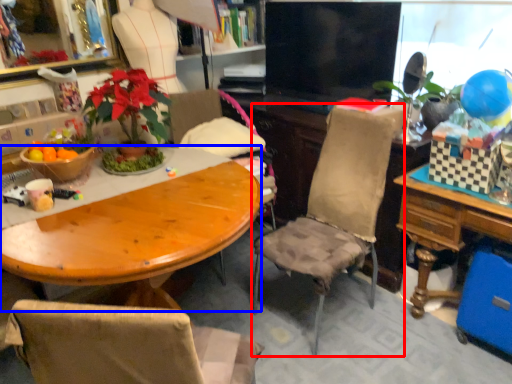
Question: Which object appears closest to the camera in this image, chair (highlighted by a red box) or desk (highlighted by a blue box)?

Choices:
 (A) chair
 (B) desk

Answer: (B)